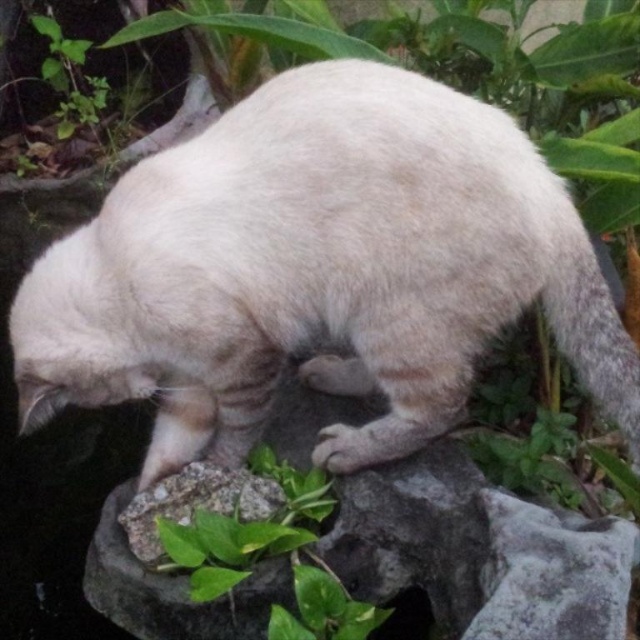
You are a photographer aiming to capture a closeup of the green leafy plant at center without the white fur cat at center blocking the view. Based on their positions, can you position yourself so that the cat is not in front of the plant?

The white fur cat at center is above the green leafy plant at center, so positioning yourself below the plant or adjusting your angle to look upwards might allow you to capture the plant without the cat obstructing the view.

You are a photographer trying to capture the white fur cat at center. You need to place a treat at point (317, 272) to attract it. Will the treat be placed on the cat?

Yes, the treat will be placed on the white fur cat at center because the point (317, 272) is on the cat.